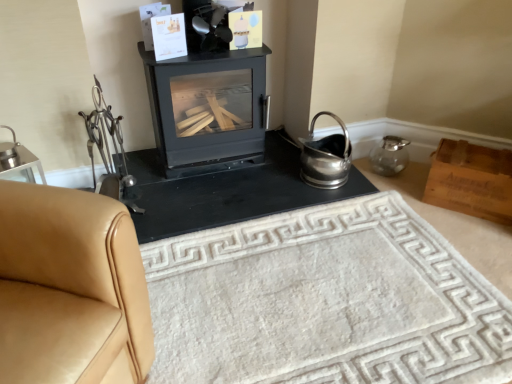
You are a GUI agent. You are given a task and a screenshot of the screen. Output one action in this format:
    pyautogui.click(x=<x>, y=<y>)
    Task: Click on the black matte wood burning stove at center
    
    Given the screenshot: What is the action you would take?
    pyautogui.click(x=208, y=109)

The width and height of the screenshot is (512, 384). I want to click on black matte fireplace at center, so click(226, 192).

Consider the image. Would you say wooden box at right is a long distance from tan leather couch at left?

Yes, wooden box at right and tan leather couch at left are located far from each other.

Considering the positions of objects wooden box at right and tan leather couch at left in the image provided, who is more to the right, wooden box at right or tan leather couch at left?

From the viewer's perspective, wooden box at right appears more on the right side.

Is wooden box at right looking in the opposite direction of tan leather couch at left?

No.

Which object is further away from the camera, wooden box at right or tan leather couch at left?

wooden box at right is more distant.

Considering the relative sizes of black matte wood burning stove at center and white textured rug at center in the image provided, is black matte wood burning stove at center shorter than white textured rug at center?

In fact, black matte wood burning stove at center may be taller than white textured rug at center.

Is point (246, 95) positioned behind point (227, 293)?

Yes, point (246, 95) is farther from viewer.

How different are the orientations of black matte wood burning stove at center and white textured rug at center in degrees?

The angle between the facing direction of black matte wood burning stove at center and the facing direction of white textured rug at center is 2.68 degrees.

Based on the photo, visually, is black matte wood burning stove at center positioned to the left or to the right of white textured rug at center?

black matte wood burning stove at center is to the left of white textured rug at center.

Is black matte fireplace at center oriented towards wooden box at right?

No, black matte fireplace at center is not turned towards wooden box at right.

Consider the image. From the image's perspective, does black matte fireplace at center appear higher than wooden box at right?

Indeed, from the image's perspective, black matte fireplace at center is shown above wooden box at right.

Which of these two, black matte fireplace at center or wooden box at right, stands taller?

Standing taller between the two is wooden box at right.

Is black matte fireplace at center directly adjacent to wooden box at right?

They are not placed beside each other.

Is black matte wood burning stove at center completely or partially outside of wooden box at right?

Yes.

Locate an element on the screen. Image resolution: width=512 pixels, height=384 pixels. box behind the black matte wood burning stove at center is located at coordinates (471, 180).

Is black matte wood burning stove at center oriented away from wooden box at right?

No, wooden box at right is not at the back of black matte wood burning stove at center.

Is black matte wood burning stove at center thinner than wooden box at right?

No, black matte wood burning stove at center is not thinner than wooden box at right.

Is black matte wood burning stove at center closer to camera compared to black matte fireplace at center?

Yes, black matte wood burning stove at center is closer to the camera.

Could you tell me if black matte wood burning stove at center is turned towards black matte fireplace at center?

No, black matte wood burning stove at center does not turn towards black matte fireplace at center.

Is black matte wood burning stove at center smaller than black matte fireplace at center?

No, black matte wood burning stove at center is not smaller than black matte fireplace at center.

Is black matte wood burning stove at center completely or partially outside of black matte fireplace at center?

Absolutely, black matte wood burning stove at center is external to black matte fireplace at center.

Looking at the image, does tan leather couch at left seem bigger or smaller compared to black matte wood burning stove at center?

Considering their sizes, tan leather couch at left takes up more space than black matte wood burning stove at center.

How different are the orientations of tan leather couch at left and black matte wood burning stove at center in degrees?

49.7 degrees.

Does tan leather couch at left lie in front of black matte wood burning stove at center?

Yes.

Is white textured rug at center taller than black matte wood burning stove at center?

No.

Is black matte wood burning stove at center located within white textured rug at center?

No.

Which is more to the left, white textured rug at center or black matte wood burning stove at center?

black matte wood burning stove at center is more to the left.

This screenshot has height=384, width=512. I want to click on furniture lying in front of the wooden box at right, so click(79, 258).

This screenshot has height=384, width=512. In order to click on wood burning stove lying above the white textured rug at center (from the image's perspective) in this screenshot , I will do `click(208, 109)`.

Consider the image. Looking at the image, which one is located closer to tan leather couch at left, white textured rug at center or wooden box at right?

The object closer to tan leather couch at left is white textured rug at center.

Based on their spatial positions, is black matte fireplace at center or wooden box at right closer to black matte wood burning stove at center?

Based on the image, black matte fireplace at center appears to be nearer to black matte wood burning stove at center.

When comparing their distances from white textured rug at center, does black matte wood burning stove at center or wooden box at right seem further?

black matte wood burning stove at center.

Looking at the image, which one is located further to black matte wood burning stove at center, tan leather couch at left or black matte fireplace at center?

tan leather couch at left.

Which object lies further to the anchor point white textured rug at center, black matte fireplace at center or wooden box at right?

Based on the image, wooden box at right appears to be further to white textured rug at center.

Estimate the real-world distances between objects in this image. Which object is further from tan leather couch at left, white textured rug at center or black matte fireplace at center?

Based on the image, black matte fireplace at center appears to be further to tan leather couch at left.

Estimate the real-world distances between objects in this image. Which object is closer to black matte wood burning stove at center, white textured rug at center or tan leather couch at left?

The object closer to black matte wood burning stove at center is white textured rug at center.

Which object lies further to the anchor point black matte wood burning stove at center, wooden box at right or tan leather couch at left?

Among the two, tan leather couch at left is located further to black matte wood burning stove at center.

At what (x,y) coordinates should I click in order to perform the action: click on wood burning stove positioned between tan leather couch at left and black matte fireplace at center from near to far. Please return your answer as a coordinate pair (x, y). Looking at the image, I should click on point(208,109).

At what (x,y) coordinates should I click in order to perform the action: click on doormat between black matte wood burning stove at center and wooden box at right. Please return your answer as a coordinate pair (x, y). Looking at the image, I should click on (325, 301).

In order to click on table between black matte wood burning stove at center and wooden box at right from left to right in this screenshot , I will do `click(226, 192)`.

This screenshot has height=384, width=512. Identify the location of doormat between black matte fireplace at center and wooden box at right from left to right. (325, 301).